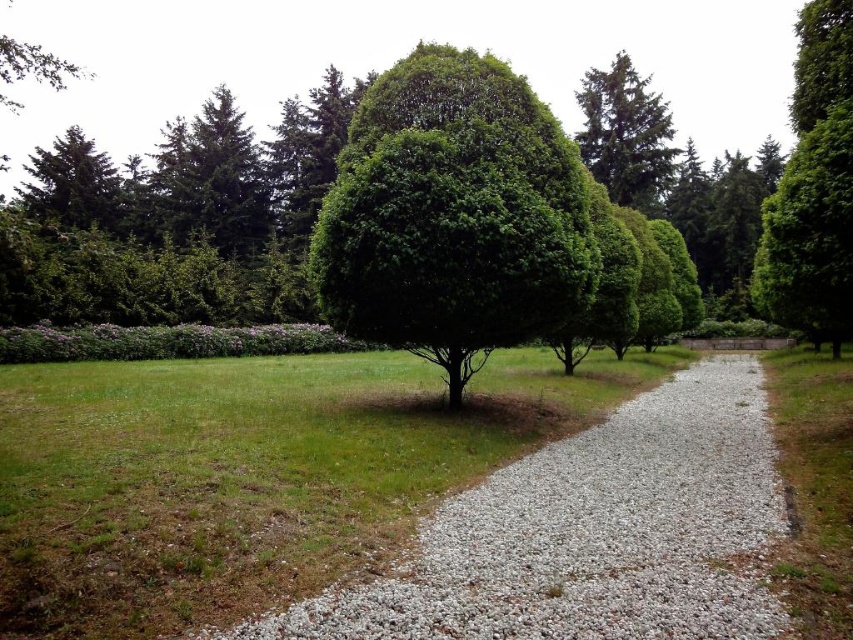
Question: In this image, where is green leafy tree at center located relative to green leafy tree at right?

Choices:
 (A) right
 (B) left

Answer: (B)

Question: Which object is the closest to the white gravel at center?

Choices:
 (A) green textured tree at upper right
 (B) green leafy tree at center

Answer: (B)

Question: Which point is farther from the camera taking this photo?

Choices:
 (A) (845, 120)
 (B) (352, 275)
 (C) (660, 134)

Answer: (C)

Question: Which is farther from the green textured tree at upper right?

Choices:
 (A) white gravel at center
 (B) green leafy tree at center
 (C) green leafy tree at right

Answer: (A)

Question: Is white gravel at center below green textured tree at upper right?

Choices:
 (A) no
 (B) yes

Answer: (B)

Question: Is white gravel at center thinner than green leafy tree at center?

Choices:
 (A) no
 (B) yes

Answer: (B)